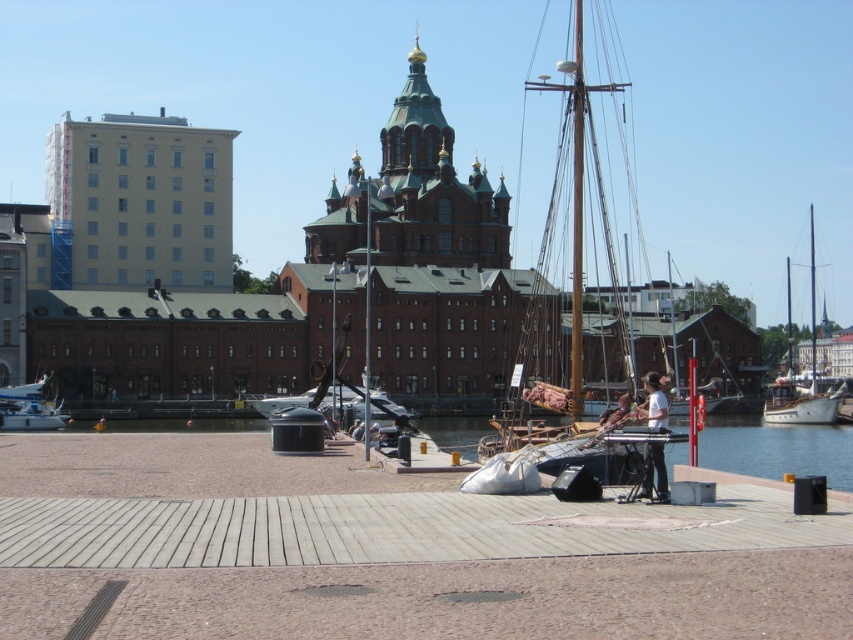
Question: Where is wooden at center located in relation to white plastic boat at lower left in the image?

Choices:
 (A) above
 (B) below

Answer: (B)

Question: Can you confirm if wooden planks at center is positioned to the left of white plastic boat at lower left?

Choices:
 (A) yes
 (B) no

Answer: (B)

Question: Can you confirm if wooden at center is positioned below wooden planks at center?

Choices:
 (A) no
 (B) yes

Answer: (B)

Question: Which object is closer to the camera taking this photo?

Choices:
 (A) wooden planks at center
 (B) wooden mast sailboat at center
 (C) white plastic boat at lower left
 (D) white wooden sailboat at right

Answer: (A)

Question: Among these points, which one is nearest to the camera?

Choices:
 (A) (782, 400)
 (B) (0, 412)

Answer: (B)

Question: Which object appears closest to the camera in this image?

Choices:
 (A) white wooden sailboat at right
 (B) transparent plastic water at lower center
 (C) wooden at center
 (D) wooden planks at center

Answer: (C)